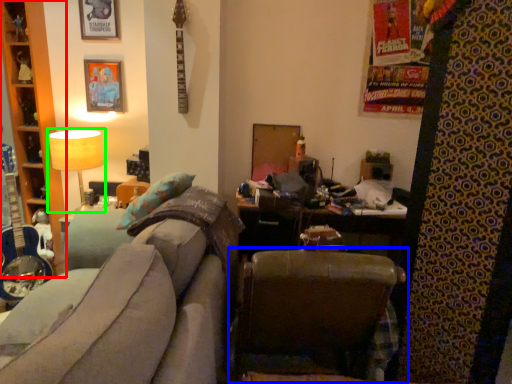
Question: Which object is the closest to the cabinet (highlighted by a red box)? Choose among these: chair (highlighted by a blue box) or table lamp (highlighted by a green box).

Choices:
 (A) chair
 (B) table lamp

Answer: (B)